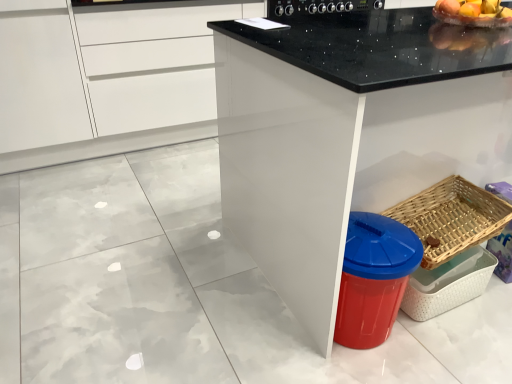
Question: Is black glossy stove at upper center in front of black granite countertop at center?

Choices:
 (A) yes
 (B) no

Answer: (B)

Question: Is black glossy stove at upper center beside black granite countertop at center?

Choices:
 (A) yes
 (B) no

Answer: (B)

Question: Is black glossy stove at upper center positioned with its back to black granite countertop at center?

Choices:
 (A) no
 (B) yes

Answer: (A)

Question: Can you confirm if black glossy stove at upper center is thinner than black granite countertop at center?

Choices:
 (A) no
 (B) yes

Answer: (B)

Question: Considering the relative sizes of black glossy stove at upper center and black granite countertop at center in the image provided, is black glossy stove at upper center wider than black granite countertop at center?

Choices:
 (A) yes
 (B) no

Answer: (B)

Question: Considering the relative positions of black glossy stove at upper center and black granite countertop at center in the image provided, is black glossy stove at upper center to the right of black granite countertop at center from the viewer's perspective?

Choices:
 (A) yes
 (B) no

Answer: (B)

Question: Does black granite countertop at center come behind shiny plastic bowl at upper right?

Choices:
 (A) no
 (B) yes

Answer: (A)

Question: Is black granite countertop at center closer to the viewer compared to shiny plastic bowl at upper right?

Choices:
 (A) no
 (B) yes

Answer: (B)

Question: Does black granite countertop at center have a greater width compared to shiny plastic bowl at upper right?

Choices:
 (A) no
 (B) yes

Answer: (B)

Question: Can you confirm if black granite countertop at center is positioned to the right of shiny plastic bowl at upper right?

Choices:
 (A) yes
 (B) no

Answer: (A)

Question: Is black granite countertop at center not near shiny plastic bowl at upper right?

Choices:
 (A) yes
 (B) no

Answer: (B)

Question: Is black granite countertop at center taller than shiny plastic bowl at upper right?

Choices:
 (A) yes
 (B) no

Answer: (A)

Question: Does black granite countertop at center have a greater height compared to woven wood basket at lower right?

Choices:
 (A) no
 (B) yes

Answer: (B)